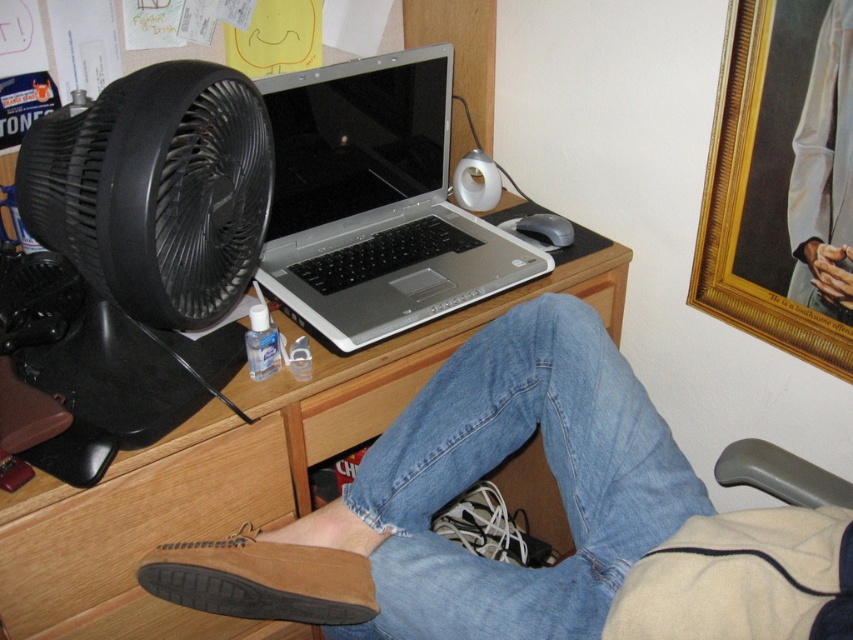
Question: Which point is closer to the camera?

Choices:
 (A) (155, 224)
 (B) (293, 166)

Answer: (A)

Question: Which object appears closest to the camera in this image?

Choices:
 (A) wooden at center
 (B) brown suede shoe at lower center
 (C) wooden drawer at lower left
 (D) white satin robe at upper right

Answer: (A)

Question: Does silver/black laptop at center have a greater width compared to wooden drawer at lower left?

Choices:
 (A) yes
 (B) no

Answer: (A)

Question: Can you confirm if wooden drawer at lower left is wider than white satin robe at upper right?

Choices:
 (A) no
 (B) yes

Answer: (B)

Question: Among these objects, which one is nearest to the camera?

Choices:
 (A) brown suede shoe at lower center
 (B) wooden drawer at lower left

Answer: (B)

Question: Can you confirm if wooden at center is bigger than gold textured picture frame at upper right?

Choices:
 (A) no
 (B) yes

Answer: (B)